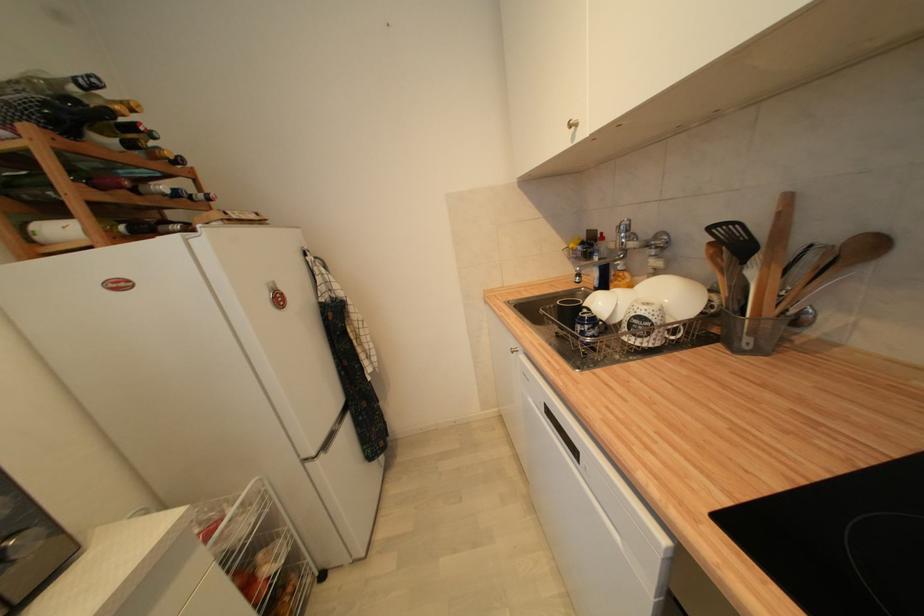
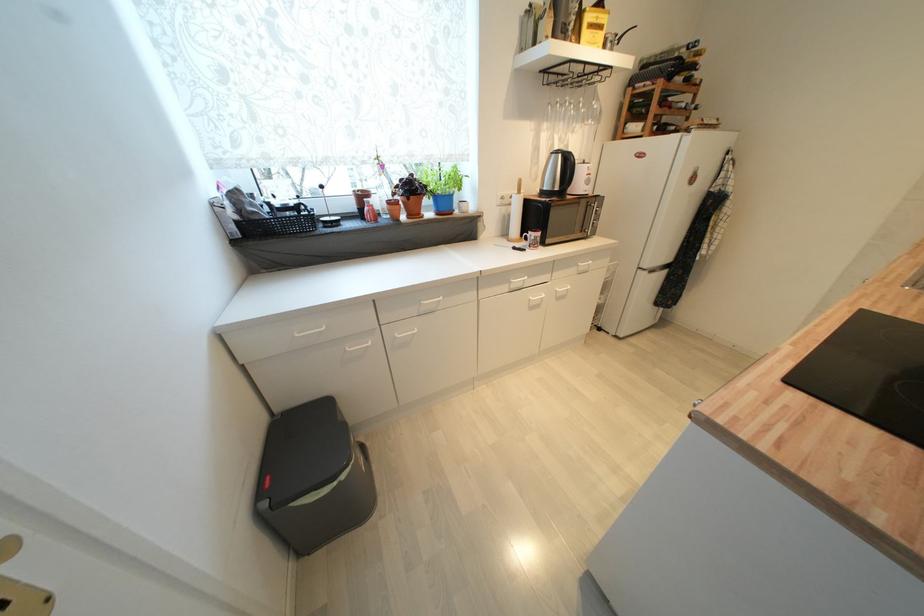
The point at (107, 199) is marked in the first image. Where is the corresponding point in the second image?

(664, 114)